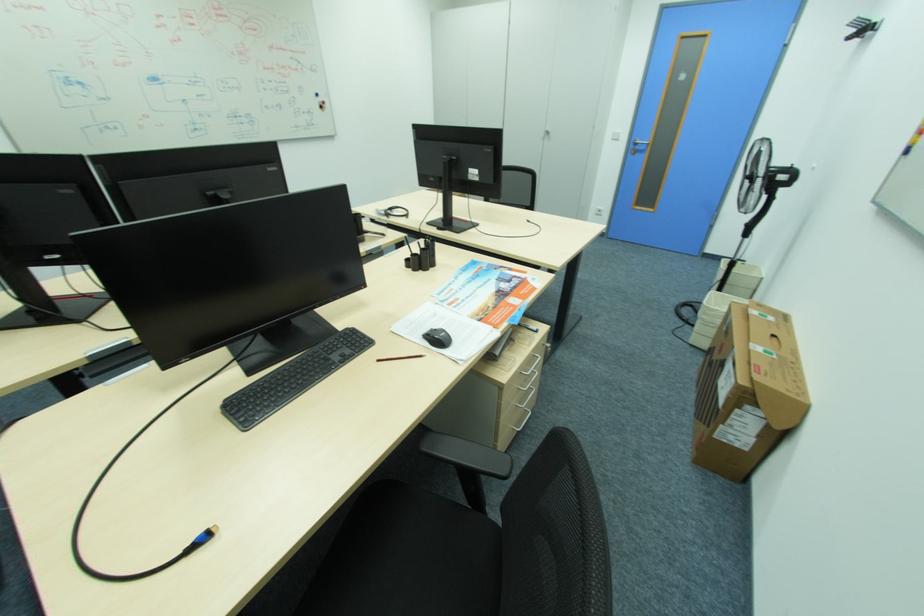
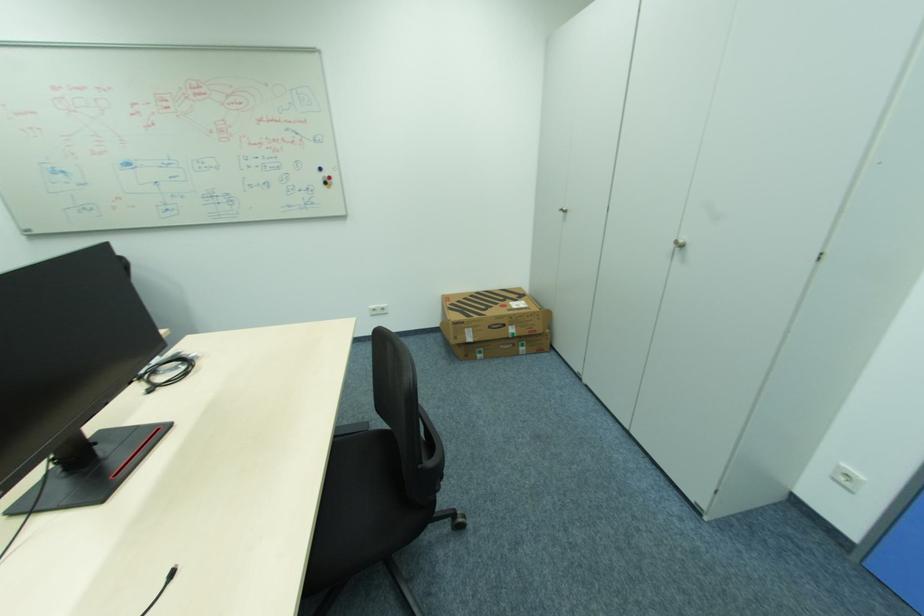
The point at (x=327, y=108) is marked in the first image. Where is the corresponding point in the second image?

(331, 184)